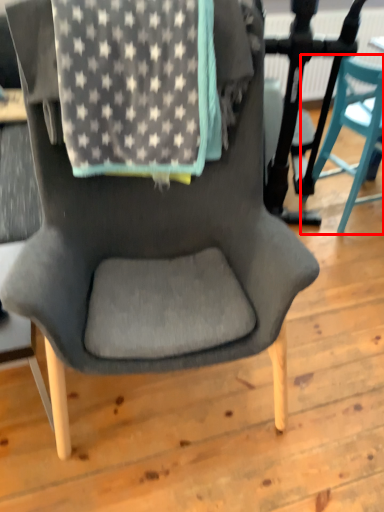
Question: From the image, what is the correct spatial relationship of chair (annotated by the red box) in relation to blanket?

Choices:
 (A) left
 (B) right

Answer: (B)